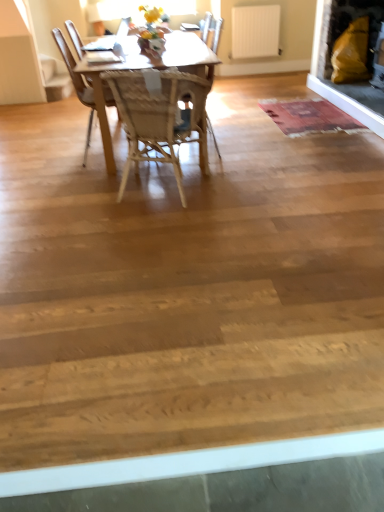
The height and width of the screenshot is (512, 384). I want to click on free spot in front of wooden chair at center, the 1th chair viewed from the back, so click(233, 161).